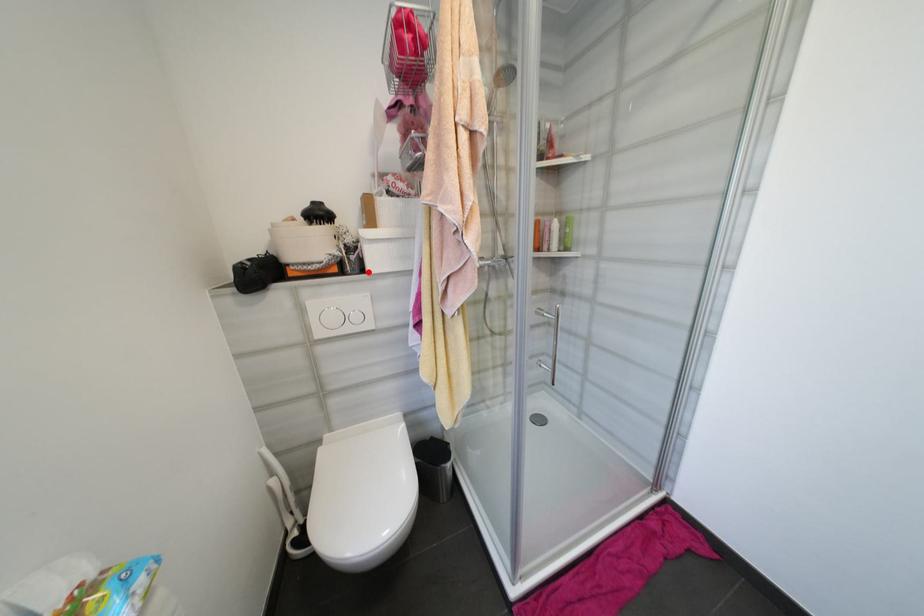
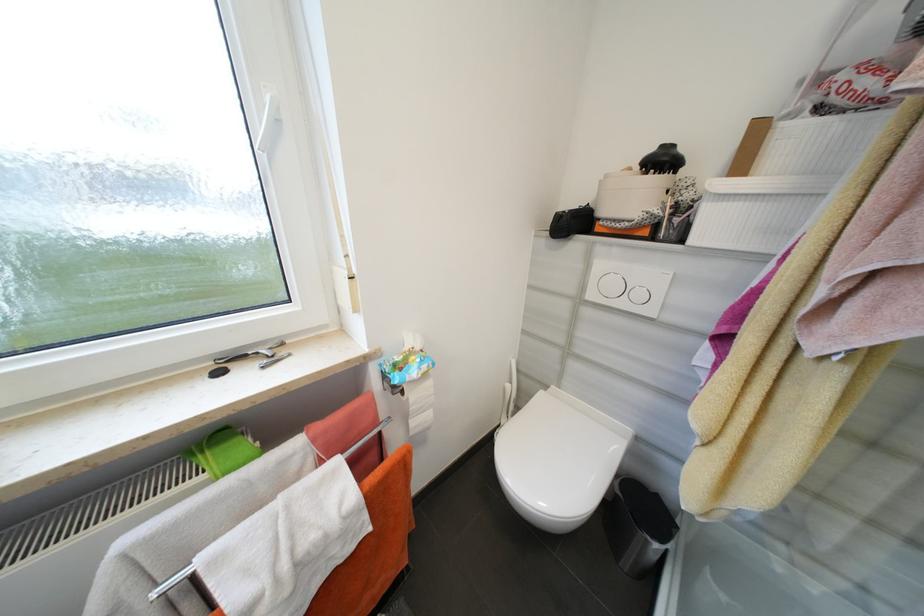
The point at the highlighted location is marked in the first image. Where is the corresponding point in the second image?

(687, 241)